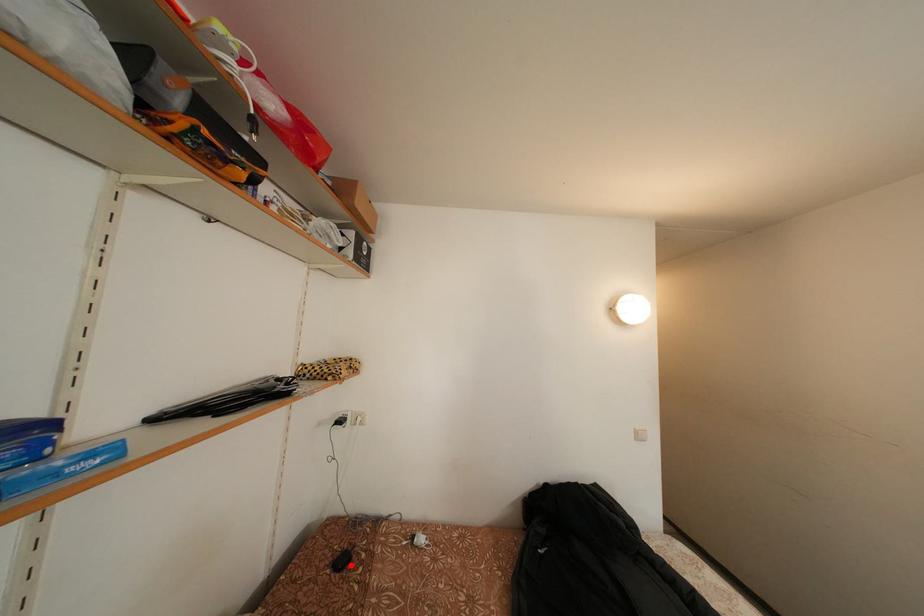
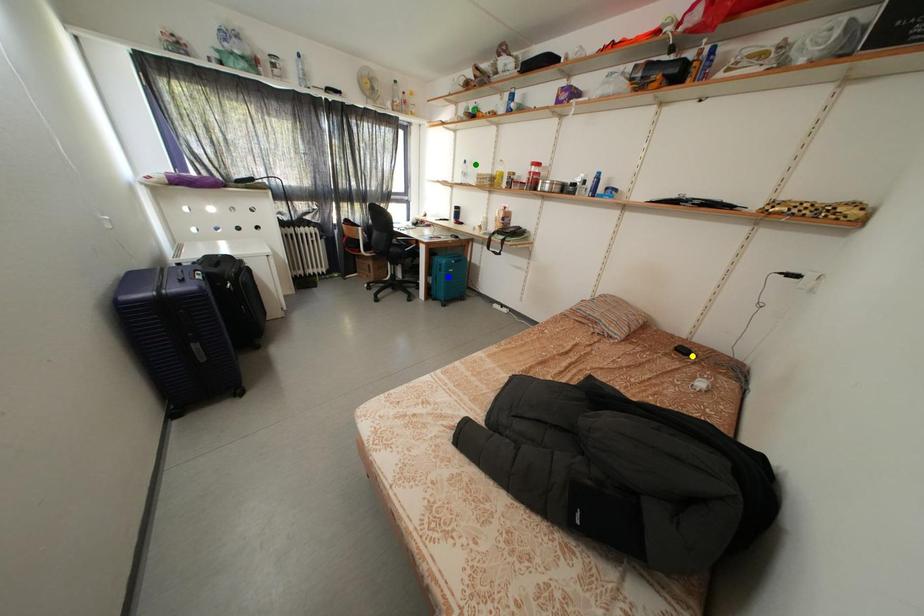
Question: I am providing you with two images of the same scene from different viewpoints. A red point is marked on the first image. You are given multiple points on the second image. Which mark in image 2 goes with the point in image 1?

Choices:
 (A) blue point
 (B) yellow point
 (C) green point

Answer: (B)